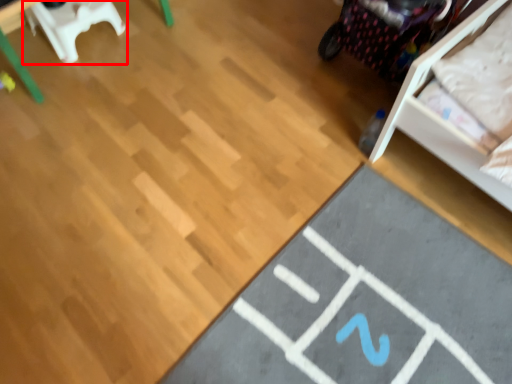
Question: Observing the image, what is the correct spatial positioning of furniture (annotated by the red box) in reference to yoga mat?

Choices:
 (A) left
 (B) right

Answer: (A)